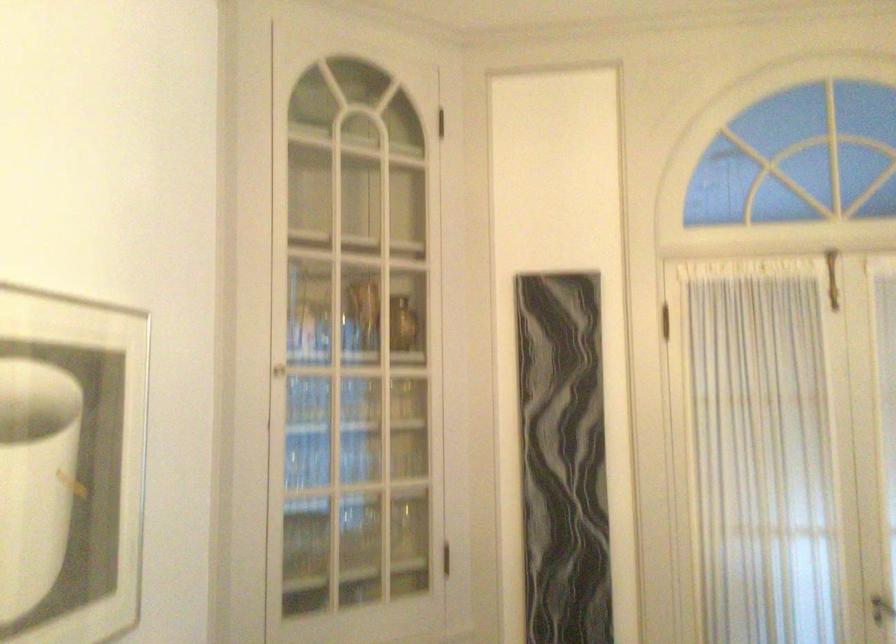
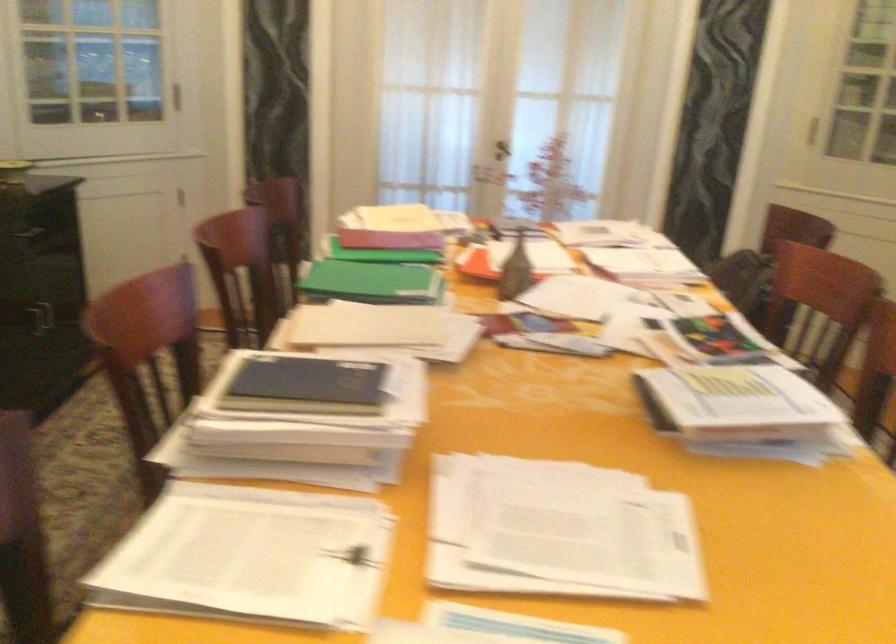
Question: Based on the continuous images, in which direction is the camera rotating? Reply with the corresponding letter.

Choices:
 (A) Left
 (B) Right
 (C) Up
 (D) Down

Answer: (D)